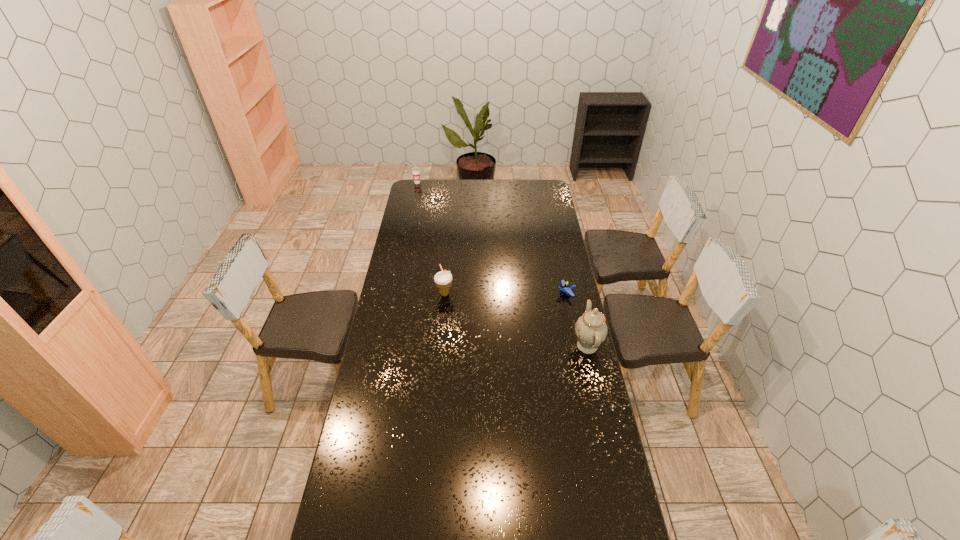
At what (x,y) coordinates should I click in order to perform the action: click on object located in the far left corner section of the desktop. Please return your answer as a coordinate pair (x, y). Looking at the image, I should click on (416, 170).

This screenshot has height=540, width=960. Identify the location of vacant space at the far edge of the desktop. (505, 185).

In the image, there is a desktop. Identify the location of vacant space at the near edge. (489, 513).

Where is `vacant space at the left edge of the desktop`? vacant space at the left edge of the desktop is located at coordinates (407, 258).

Locate an element on the screen. The image size is (960, 540). vacant space at the right edge of the desktop is located at coordinates (544, 245).

Locate an element on the screen. The width and height of the screenshot is (960, 540). vacant area at the far left corner is located at coordinates (411, 184).

You are a GUI agent. You are given a task and a screenshot of the screen. Output one action in this format:
    pyautogui.click(x=<x>, y=<y>)
    Task: Click on the vacant space in between the third object from right to left and the shortest object
    The height and width of the screenshot is (540, 960).
    Given the screenshot: What is the action you would take?
    pyautogui.click(x=505, y=293)

At what (x,y) coordinates should I click in order to perform the action: click on free spot between the third object from right to left and the Lego. Please return your answer as a coordinate pair (x, y). This screenshot has width=960, height=540. Looking at the image, I should click on (505, 293).

Image resolution: width=960 pixels, height=540 pixels. Identify the location of vacant region between the second shortest object and the shortest object. (492, 238).

Find the location of a particular element. The image size is (960, 540). unoccupied area between the tallest object and the shortest object is located at coordinates (577, 319).